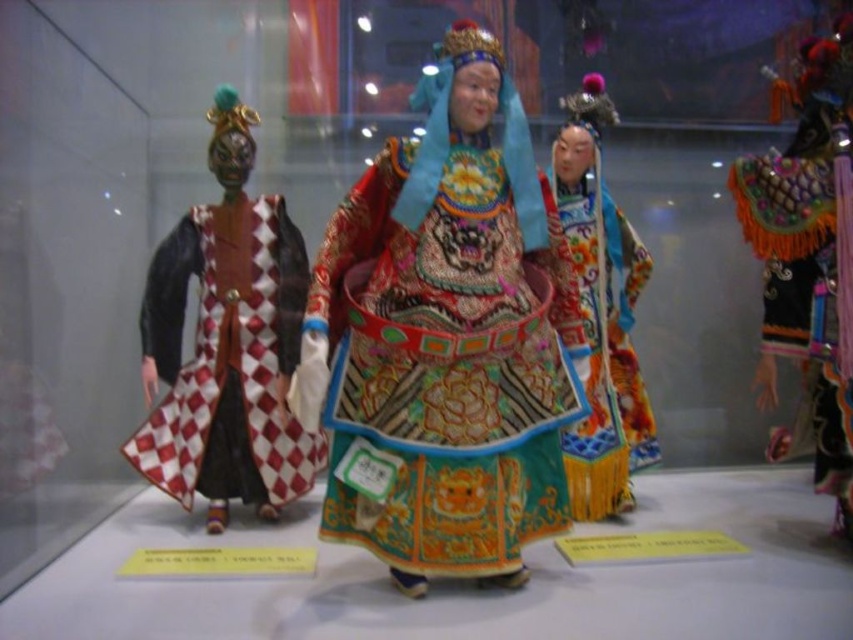
Question: Which point appears closest to the camera in this image?

Choices:
 (A) (236, 486)
 (B) (827, 472)
 (C) (403, 360)

Answer: (C)

Question: Which of these objects is positioned farthest from the embroidered silk robe at center?

Choices:
 (A) red and white checkered fabric at left
 (B) vibrant silk robe at center
 (C) velvet-like black robe at right

Answer: (C)

Question: Is embroidered silk robe at center positioned before vibrant silk robe at center?

Choices:
 (A) no
 (B) yes

Answer: (B)

Question: Which point is closer to the camera?

Choices:
 (A) (830, 323)
 (B) (637, 413)
 (C) (422, 228)

Answer: (C)

Question: Does red and white checkered fabric at left come behind vibrant silk robe at center?

Choices:
 (A) yes
 (B) no

Answer: (B)

Question: Can you confirm if red and white checkered fabric at left is bigger than velvet-like black robe at right?

Choices:
 (A) no
 (B) yes

Answer: (B)